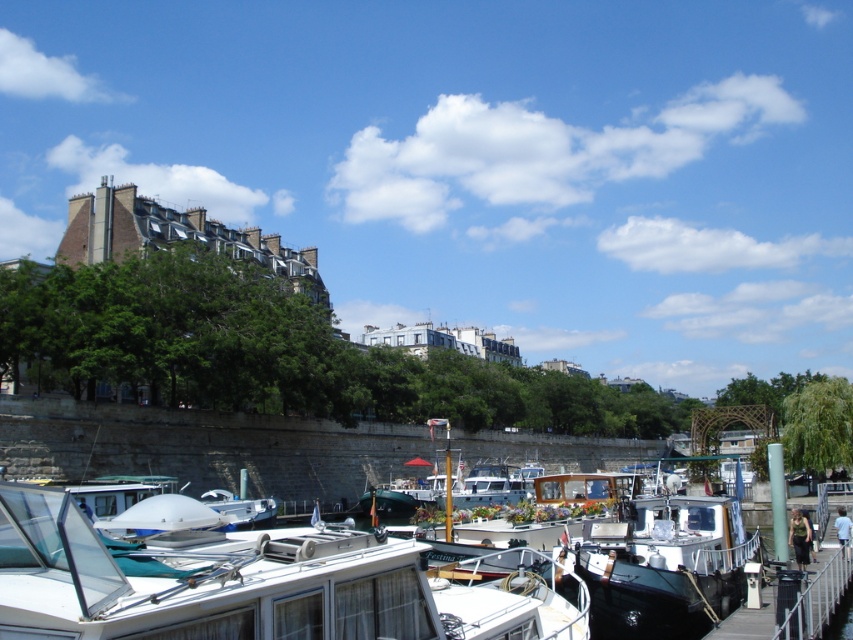
From the picture: You are standing at the point marked by coordinates point(248, 580) in the image. What object is located at this point?

The point(248, 580) marks the location of the white glossy boat at center.

Consider the image. You are standing on the wooden pier and want to locate the white glossy boat at center. According to the coordinates provided, which direction should you look to find it?

The white glossy boat at center is located at coordinates point (x=248, y=580). Since the x coordinate is 0.908, which is closer to the right edge of the image, you should look to the right side of the pier to find it.

You are standing at the riverside and want to determine which of the two points, point (508, 552) or point (656, 596), is closer to you. Based on the scene, which point is nearer?

Point (508, 552) is closer to you because it is further to the viewer than point (656, 596).